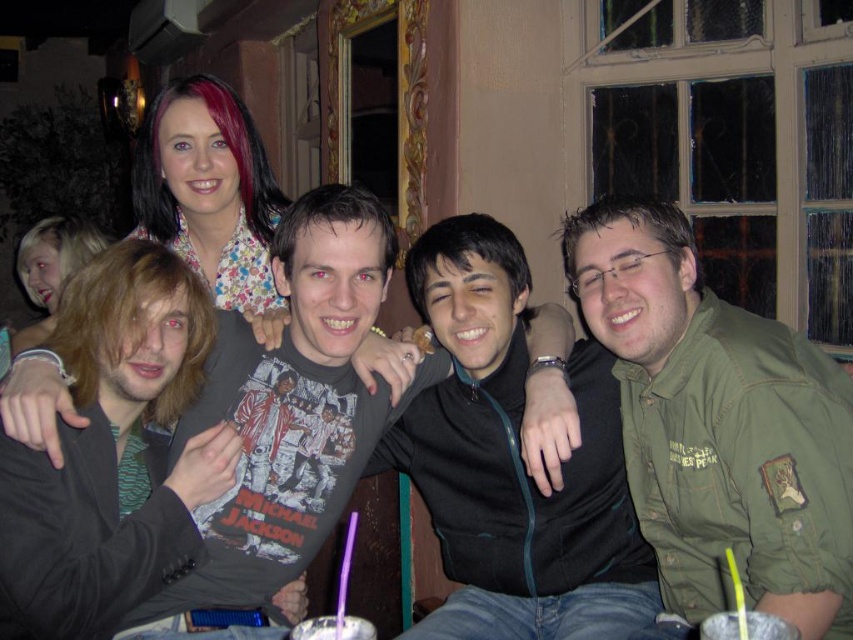
You are standing in the room and want to reach the point marked as point (635, 371). If your walking speed is 3 feet per second, how many seconds will it take you to reach that point?

The point (635, 371) is 6.75 feet away from the viewer. At a speed of 3 feet per second, it will take 6.75 divided by 3, which equals 2.25 seconds to reach the point.